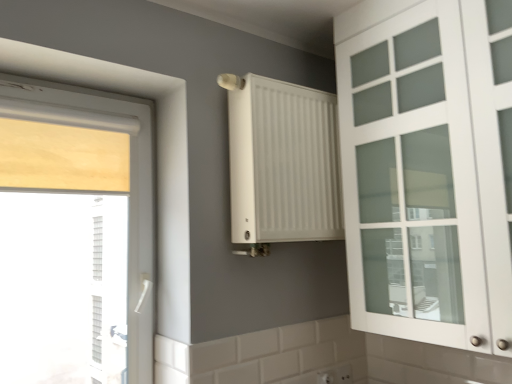
Question: Is white matte cabinet at right closer to camera compared to wooden blind at left?

Choices:
 (A) no
 (B) yes

Answer: (B)

Question: Does white matte cabinet at right have a lesser height compared to wooden blind at left?

Choices:
 (A) yes
 (B) no

Answer: (B)

Question: Is white matte cabinet at right outside wooden blind at left?

Choices:
 (A) yes
 (B) no

Answer: (A)

Question: Is white matte cabinet at right further to camera compared to wooden blind at left?

Choices:
 (A) yes
 (B) no

Answer: (B)

Question: Does white matte cabinet at right have a larger size compared to wooden blind at left?

Choices:
 (A) yes
 (B) no

Answer: (A)

Question: Does white matte cabinet at right have a smaller size compared to wooden blind at left?

Choices:
 (A) no
 (B) yes

Answer: (A)

Question: Does white plastic electric outlet at lower center have a smaller size compared to white matte cabinet at right?

Choices:
 (A) no
 (B) yes

Answer: (B)

Question: Does white plastic electric outlet at lower center have a lesser width compared to white matte cabinet at right?

Choices:
 (A) yes
 (B) no

Answer: (A)

Question: Is white plastic electric outlet at lower center closer to the viewer compared to white matte cabinet at right?

Choices:
 (A) yes
 (B) no

Answer: (B)

Question: Could you tell me if white plastic electric outlet at lower center is facing white matte cabinet at right?

Choices:
 (A) yes
 (B) no

Answer: (B)

Question: Is white plastic electric outlet at lower center at the left side of white matte cabinet at right?

Choices:
 (A) yes
 (B) no

Answer: (A)

Question: From the image's perspective, is white plastic electric outlet at lower center under white matte cabinet at right?

Choices:
 (A) yes
 (B) no

Answer: (A)

Question: Is white matte cabinet at right further to camera compared to white matte radiator at center?

Choices:
 (A) no
 (B) yes

Answer: (A)